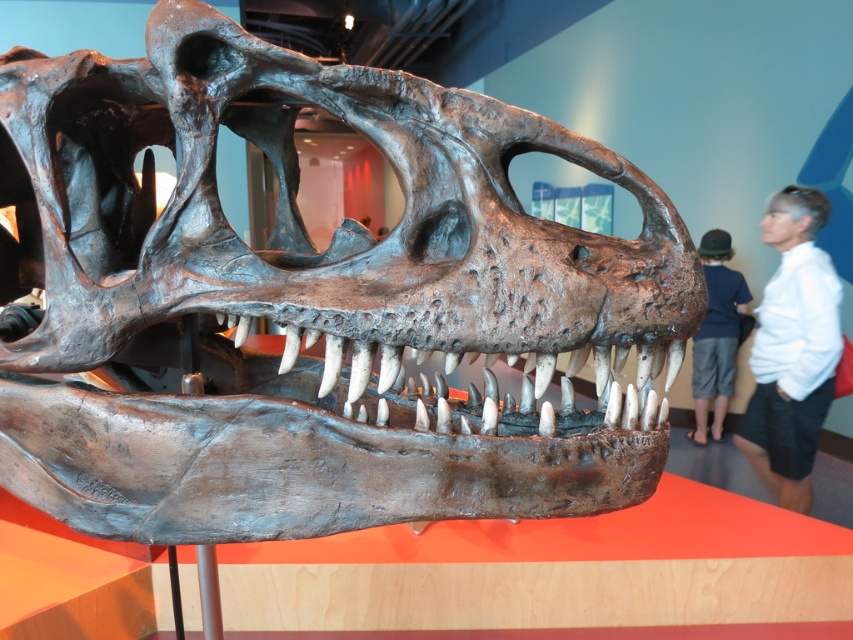
Question: Which object is positioned closest to the rusty metallic skull at center?

Choices:
 (A) dark blue shirt at right
 (B) white matte shirt at upper right

Answer: (B)

Question: Does rusty metallic skull at center have a larger size compared to dark blue shirt at right?

Choices:
 (A) yes
 (B) no

Answer: (A)

Question: Which is farther from the white matte shirt at upper right?

Choices:
 (A) rusty metallic skull at center
 (B) dark blue shirt at right

Answer: (A)

Question: Can you confirm if rusty metallic skull at center is positioned to the right of dark blue shirt at right?

Choices:
 (A) no
 (B) yes

Answer: (A)

Question: Considering the relative positions of rusty metallic skull at center and white matte shirt at upper right in the image provided, where is rusty metallic skull at center located with respect to white matte shirt at upper right?

Choices:
 (A) right
 (B) left

Answer: (B)

Question: Among these points, which one is farthest from the camera?

Choices:
 (A) (824, 196)
 (B) (154, 76)

Answer: (A)